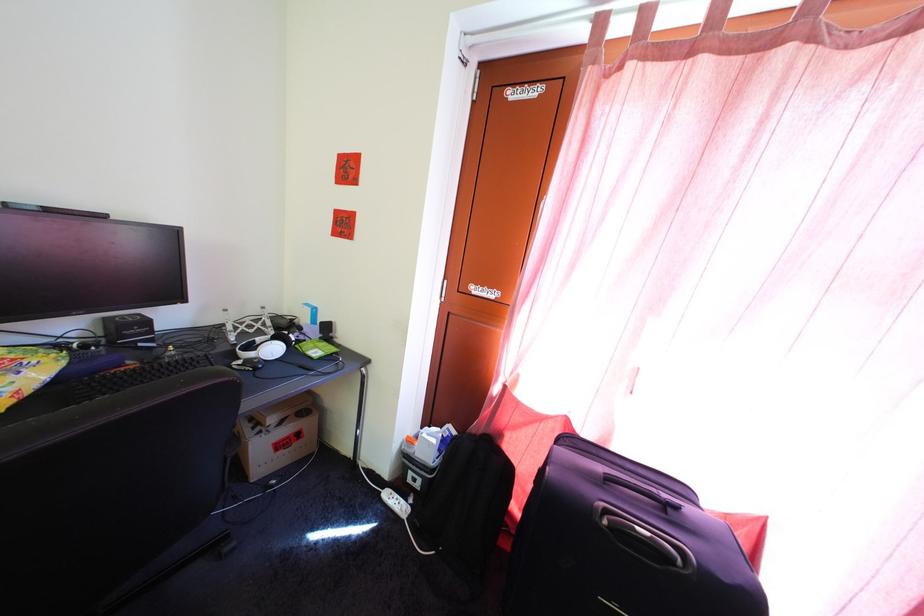
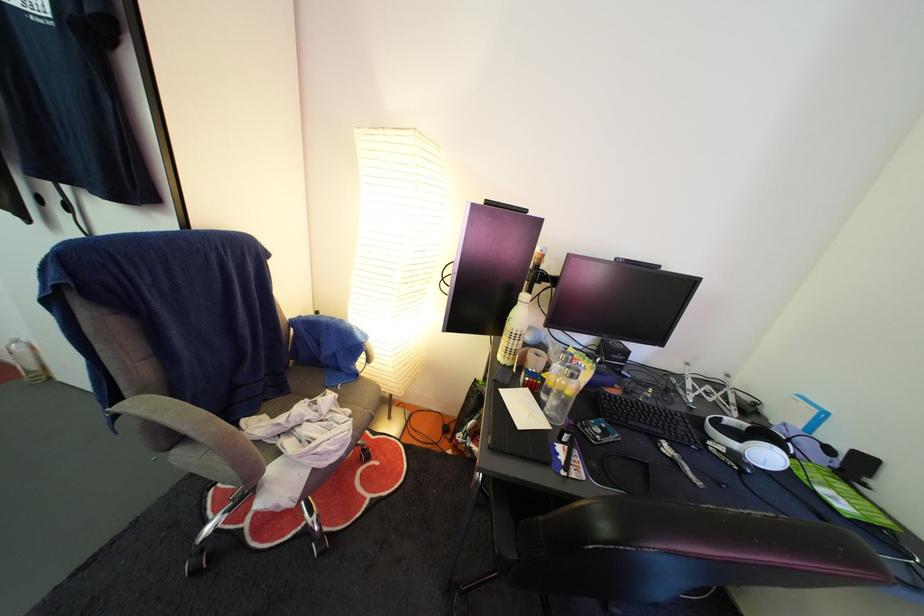
Question: The camera is either moving clockwise (left) or counter-clockwise (right) around the object. The first image is from the beginning of the video and the second image is from the end. Is the camera moving left or right when shooting the video?

Choices:
 (A) Left
 (B) Right

Answer: (B)